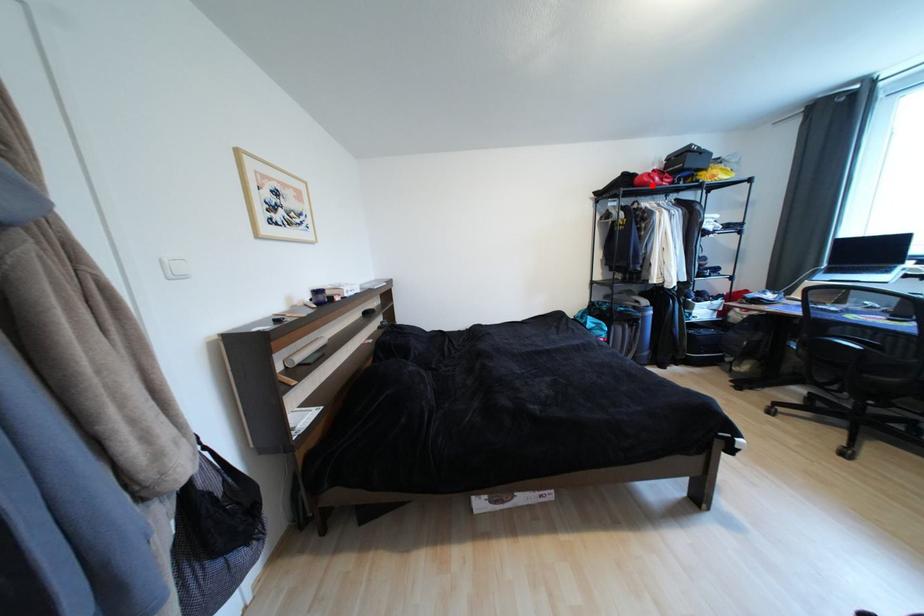
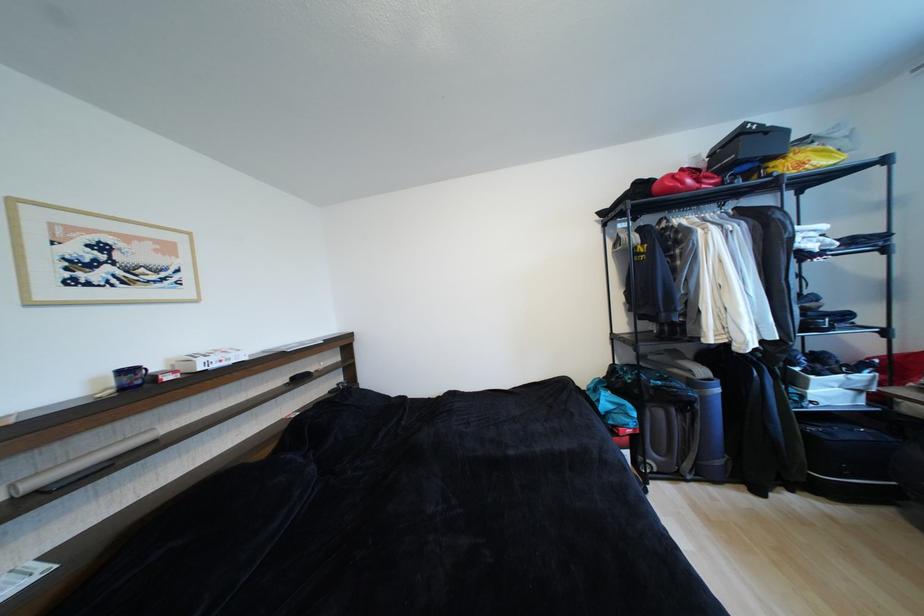
Find the pixel in the second image that matches the highlighted location in the first image.

(676, 192)